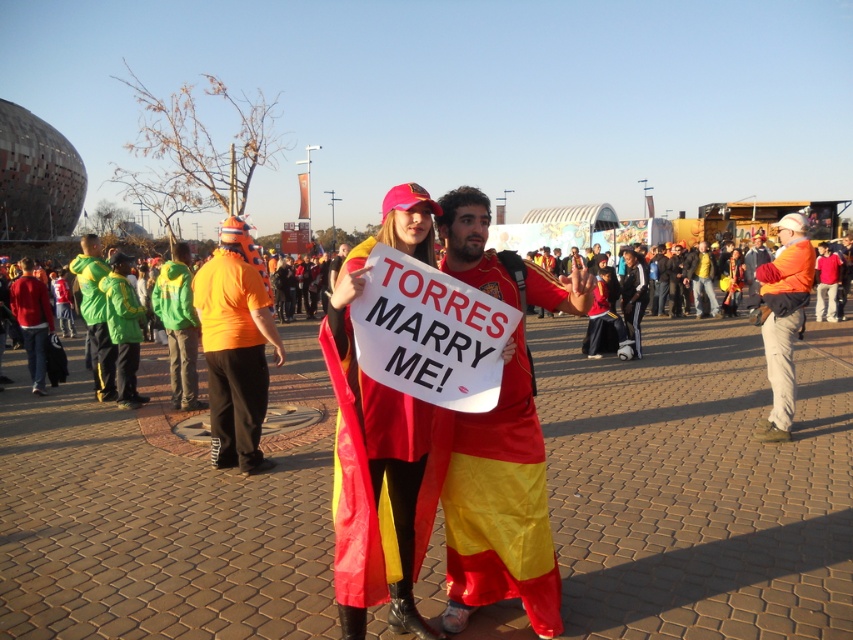
Is red/yellow fabric draped at center positioned in front of green fleece jacket at left?

Yes.

Based on the photo, can you confirm if red/yellow fabric draped at center is smaller than green fleece jacket at left?

No.

Is point (532, 588) farther from viewer compared to point (125, 296)?

That is False.

At what (x,y) coordinates should I click in order to perform the action: click on red/yellow fabric draped at center. Please return your answer as a coordinate pair (x, y). The height and width of the screenshot is (640, 853). Looking at the image, I should click on (500, 506).

Is point (352, 381) positioned before point (103, 358)?

Yes, it is in front of point (103, 358).

Can you confirm if red/yellow fabric cape at center is thinner than green fabric jacket at left?

Yes.

Locate an element on the screen. red/yellow fabric cape at center is located at coordinates (379, 472).

This screenshot has width=853, height=640. Find the location of `red/yellow fabric cape at center`. red/yellow fabric cape at center is located at coordinates (379, 472).

Is orange fabric jacket at center above green fabric jacket at left?

Actually, orange fabric jacket at center is below green fabric jacket at left.

Can you confirm if orange fabric jacket at center is smaller than green fabric jacket at left?

Correct, orange fabric jacket at center occupies less space than green fabric jacket at left.

Does point (790, 339) come closer to viewer compared to point (97, 292)?

That is True.

Find the location of a particular element. orange fabric jacket at center is located at coordinates (782, 317).